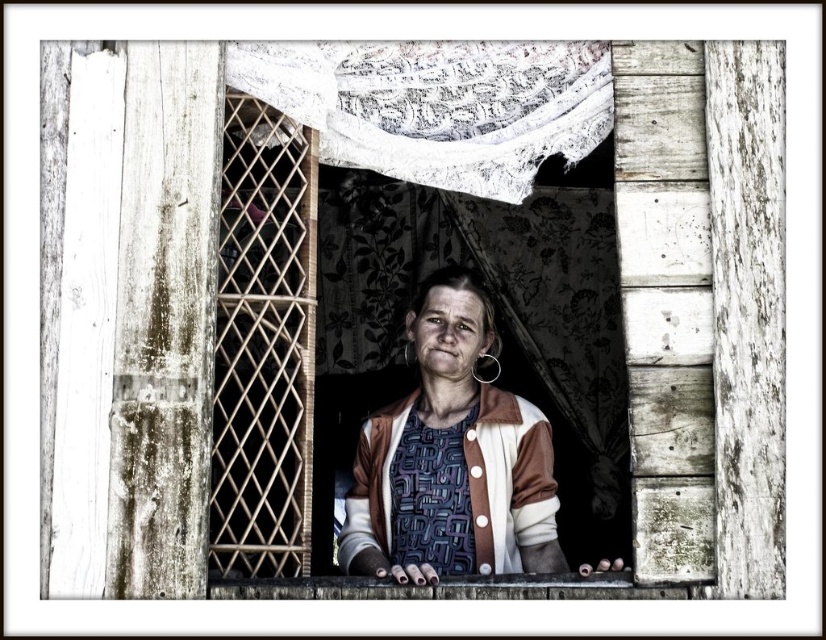
You are a photographer standing 30 meters away from the scene. You want to take a clear photo of the brown textured sweater at center. Is the sweater within your camera range?

The brown textured sweater at center is 29.03 meters away from the viewer, so yes, it is within the camera range since it is closer than 30 meters.

You are standing in the rustic wooden structure and want to touch the point at coordinates (452, 458). Which object will your hand first come into contact with?

The point at coordinates (452, 458) is on the brown textured sweater at center, so your hand will first come into contact with the brown textured sweater at center.

You are a fashion designer observing the scene. You notice the brown textured sweater at center and the white lace curtain at upper center. Which object is positioned to the right of the other?

The brown textured sweater at center is to the right of the white lace curtain at upper center.